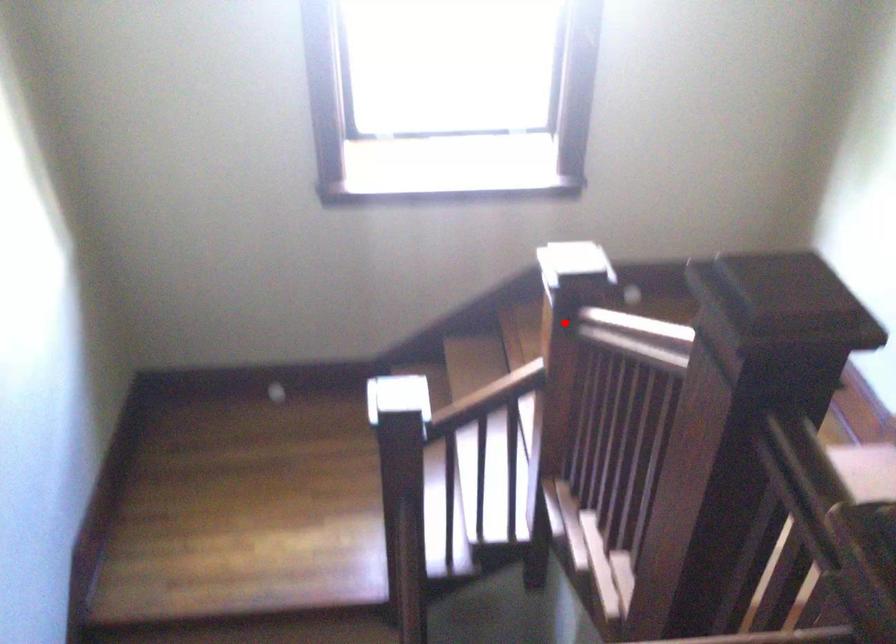
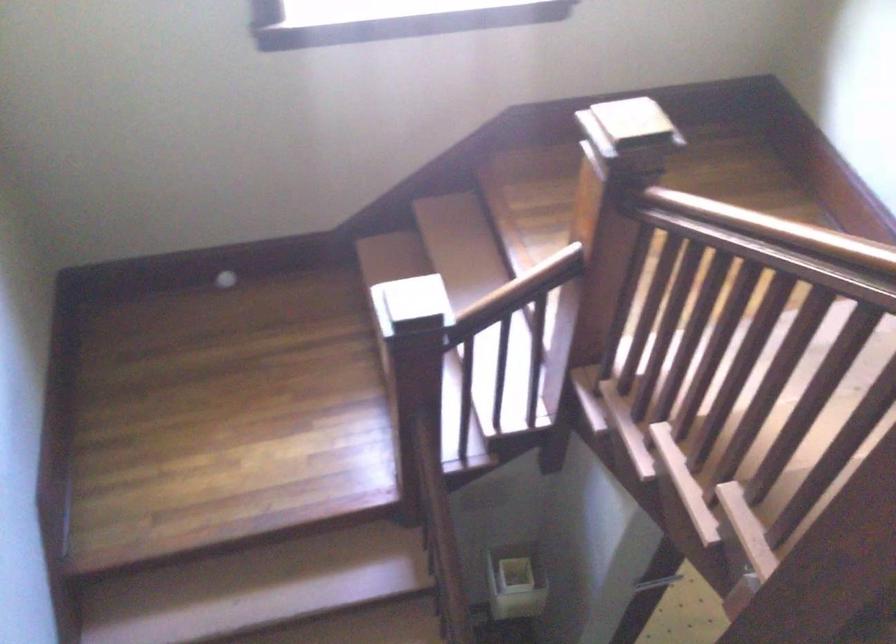
Where in the second image is the point corresponding to the highlighted location from the first image?

(613, 205)